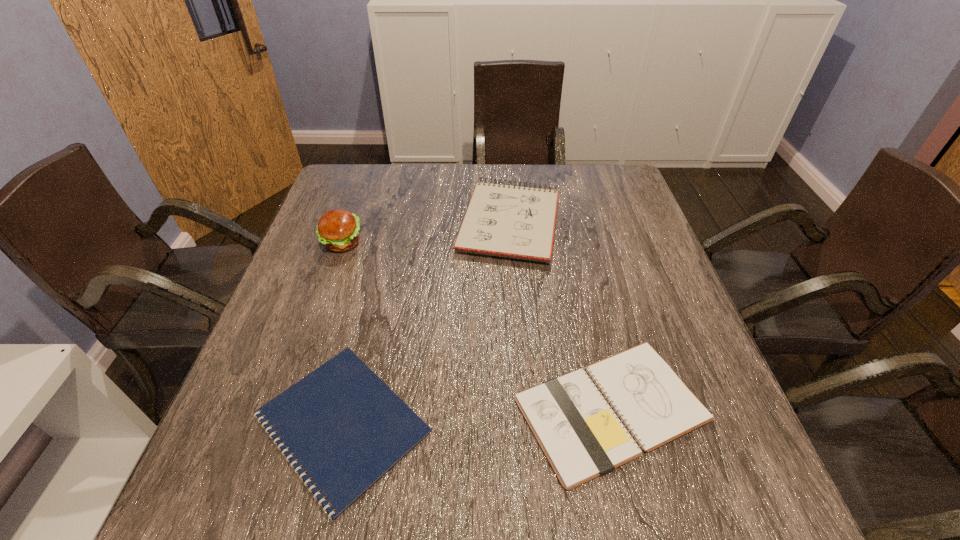
Where is `the tallest object`? This screenshot has height=540, width=960. the tallest object is located at coordinates (338, 230).

I want to click on the third shortest object, so click(x=517, y=222).

The image size is (960, 540). I want to click on the tallest notepad, so click(x=517, y=222).

I want to click on the third tallest object, so tap(582, 438).

The width and height of the screenshot is (960, 540). I want to click on the shortest notepad, so click(343, 424).

Where is `the shortest object`? the shortest object is located at coordinates (343, 424).

Locate an element on the screen. The height and width of the screenshot is (540, 960). vacant space located on the front of the hamburger is located at coordinates (296, 374).

Image resolution: width=960 pixels, height=540 pixels. Identify the location of free spot located on the front of the farthest notepad. (517, 327).

This screenshot has width=960, height=540. I want to click on vacant region located 0.230m on the back of the second shortest notepad, so click(x=578, y=271).

Image resolution: width=960 pixels, height=540 pixels. In order to click on free point located 0.200m on the right of the leftmost notepad in this screenshot , I will do `click(543, 423)`.